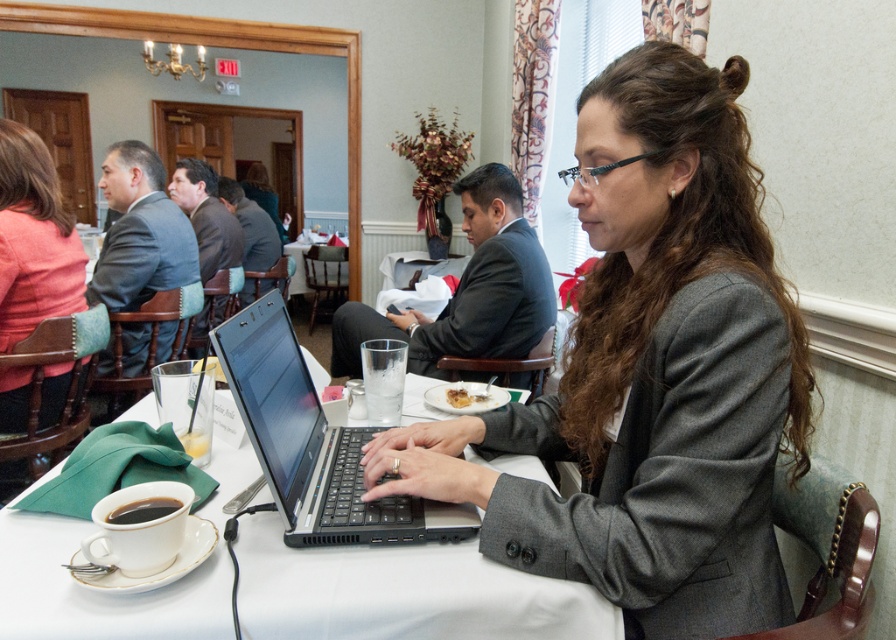
Based on the photo, is black matte laptop at center above slightly browned bread at center?

No.

The width and height of the screenshot is (896, 640). Describe the element at coordinates (315, 444) in the screenshot. I see `black matte laptop at center` at that location.

Is point (388, 499) positioned after point (478, 397)?

No.

Locate an element on the screen. black matte laptop at center is located at coordinates (315, 444).

Between point (694, 624) and point (444, 556), which one is positioned in front?

Positioned in front is point (444, 556).

I want to click on gray wool blazer at center, so click(651, 372).

In the scene shown: Does white glossy table at center appear on the right side of matte black laptop at center?

Yes, white glossy table at center is to the right of matte black laptop at center.

Between white glossy table at center and matte black laptop at center, which one is positioned higher?

matte black laptop at center is higher up.

Find the location of a particular element. The width and height of the screenshot is (896, 640). white glossy table at center is located at coordinates (403, 593).

Where is `white glossy table at center`? white glossy table at center is located at coordinates (403, 593).